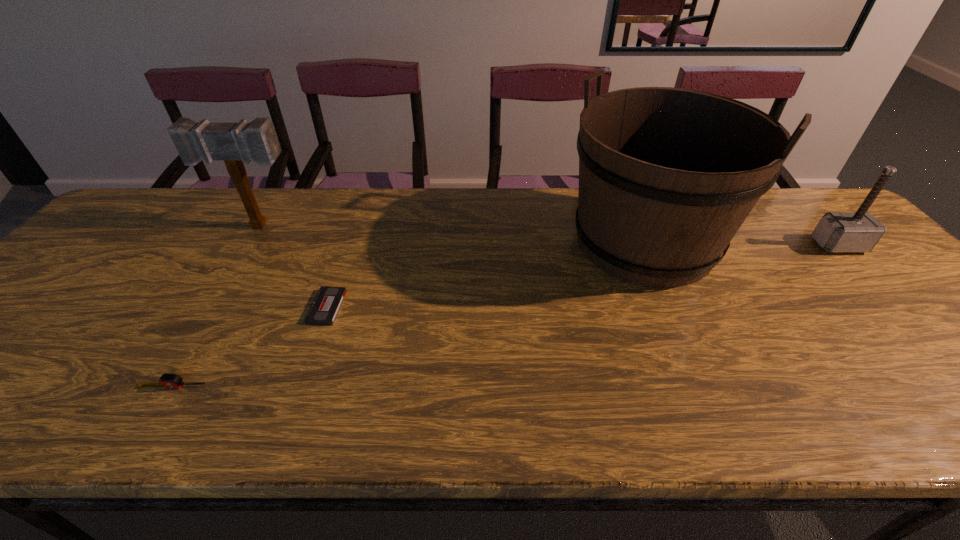
You are a GUI agent. You are given a task and a screenshot of the screen. Output one action in this format:
    pyautogui.click(x=<x>, y=<y>)
    Task: Click on the object that stands as the fourth closest to the nearest object
    Image resolution: width=960 pixels, height=540 pixels.
    Given the screenshot: What is the action you would take?
    pyautogui.click(x=860, y=231)